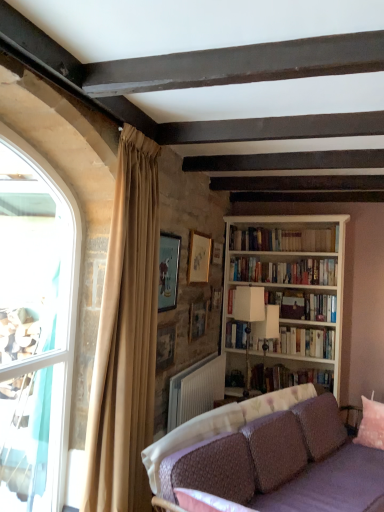
Question: Does point (254, 388) appear closer or farther from the camera than point (168, 350)?

Choices:
 (A) farther
 (B) closer

Answer: (A)

Question: Is hardcover book at center, which is the 4th book from top to bottom, spatially inside wooden picture frame at upper center, which is counted as the fourth picture frame, starting from the back, or outside of it?

Choices:
 (A) outside
 (B) inside

Answer: (A)

Question: Estimate the real-world distances between objects in this image. Which object is farther from the pink fabric pillow at lower right?

Choices:
 (A) white plastic radiator at lower center
 (B) hardcover book at center, which is the 4th book from top to bottom
 (C) white wooden bookcase at right
 (D) clear glass window at left
 (E) white matte bookshelf at center, the second book when ordered from bottom to top

Answer: (D)

Question: Which of these objects is positioned closest to the hardcover book at center, which is the 4th book from top to bottom?

Choices:
 (A) white wooden bookcase at right
 (B) pink fabric pillow at lower right
 (C) purple fabric couch at lower right
 (D) beige velvet curtain at left
 (E) matte gold picture frame at upper center, which appears as the 3th picture frame when viewed from the back

Answer: (A)